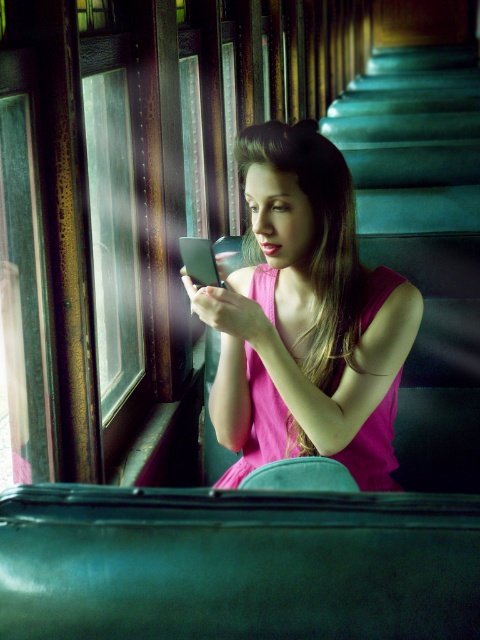
You are a photographer trying to capture a closeup of the pink satin dress at center without including the green plush stairs at right in the frame. Given their sizes, is this possible?

The pink satin dress at center is smaller than the green plush stairs at right, so it is possible to capture a closeup of the pink satin dress at center without including the green plush stairs at right in the frame by focusing on the smaller object and adjusting the camera angle or zoom accordingly.

You are a photographer inside the train car and want to take a photo of the pink satin dress at center and the green plush stairs at right. Which object is shorter?

The pink satin dress at center is shorter than the green plush stairs at right.